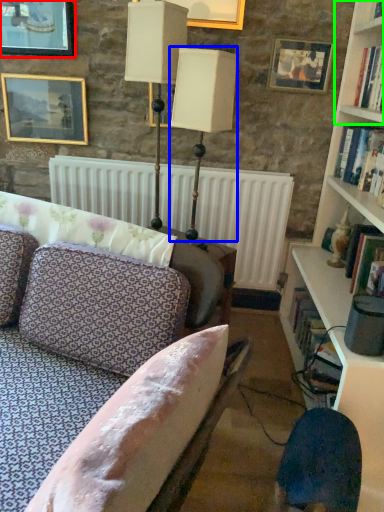
Question: Considering the real-world distances, which object is closest to picture frame (highlighted by a red box)? table lamp (highlighted by a blue box) or shelf (highlighted by a green box).

Choices:
 (A) table lamp
 (B) shelf

Answer: (A)